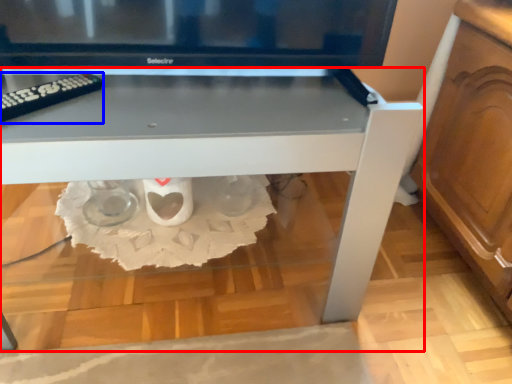
Question: Among these objects, which one is nearest to the camera, table (highlighted by a red box) or remote (highlighted by a blue box)?

Choices:
 (A) table
 (B) remote

Answer: (A)